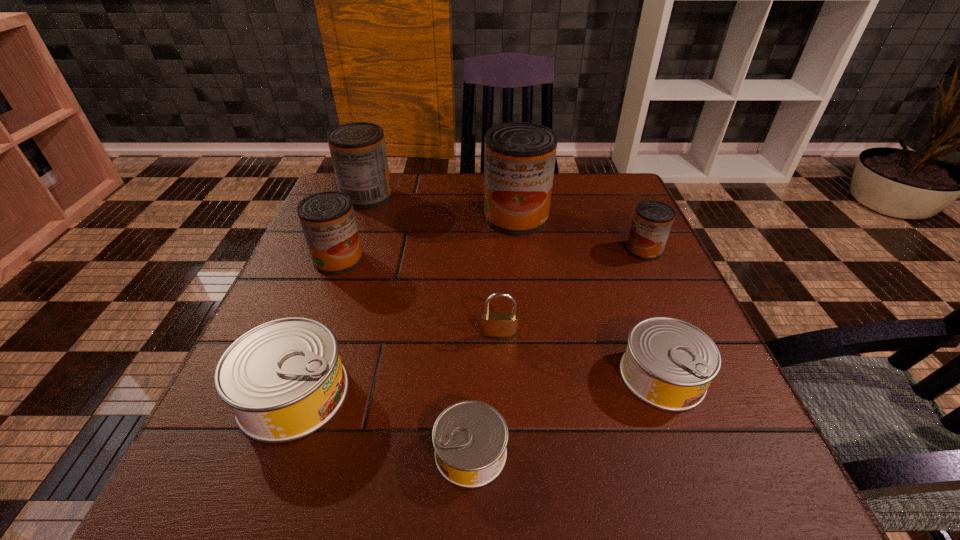
What are the coordinates of `can identified as the third closest to the biggest red can` in the screenshot? It's located at (328, 222).

This screenshot has width=960, height=540. In order to click on can that is the fourth closest to the second smallest silver can in this screenshot , I will do `click(283, 380)`.

Where is `red can that can be found as the closest to the second biggest red can`? red can that can be found as the closest to the second biggest red can is located at coordinates (328, 222).

Identify which red can is the nearest to the rightmost silver can. Please provide its 2D coordinates. Your answer should be formatted as a tuple, i.e. [(x, y)], where the tuple contains the x and y coordinates of a point satisfying the conditions above.

[(652, 222)]

You are a GUI agent. You are given a task and a screenshot of the screen. Output one action in this format:
    pyautogui.click(x=<x>, y=<y>)
    Task: Click on the silver can that is the third closest one to the tallest can
    The height and width of the screenshot is (540, 960).
    Given the screenshot: What is the action you would take?
    pyautogui.click(x=470, y=438)

Locate an element on the screen. This screenshot has width=960, height=540. silver can that is the closest one to the rightmost red can is located at coordinates (669, 363).

The width and height of the screenshot is (960, 540). I want to click on vacant space that satisfies the following two spatial constraints: 1. on the back side of the smallest red can; 2. on the left side of the second shortest object, so click(x=615, y=250).

The height and width of the screenshot is (540, 960). Identify the location of vacant area in the image that satisfies the following two spatial constraints: 1. on the back side of the second shortest object; 2. on the right side of the leftmost silver can. (300, 375).